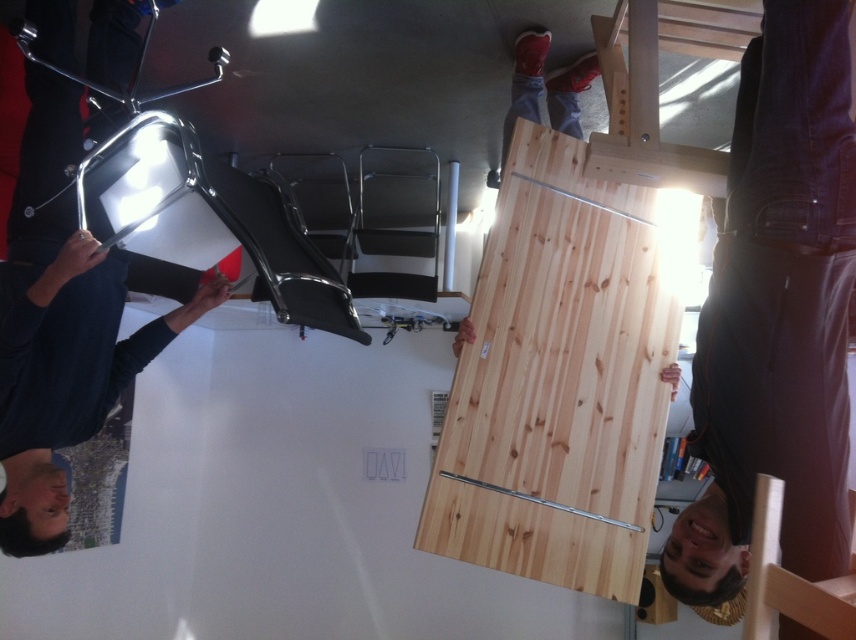
You are trying to determine the position of two items in the rotated image. The jeans at lower right and the red leather shoes at upper center are visible. Based on their positions, which item is closer to the bottom edge of the original unrotated image?

The jeans at lower right is closer to the bottom edge of the original unrotated image because it is positioned below the red leather shoes at upper center in the rotated view.

You are helping to assemble furniture in an office. You have two pieces labeled natural wood plywood at center and natural wood beam at center. Which piece is bigger in size?

The natural wood plywood at center is larger in size compared to the natural wood beam at center according to the description.